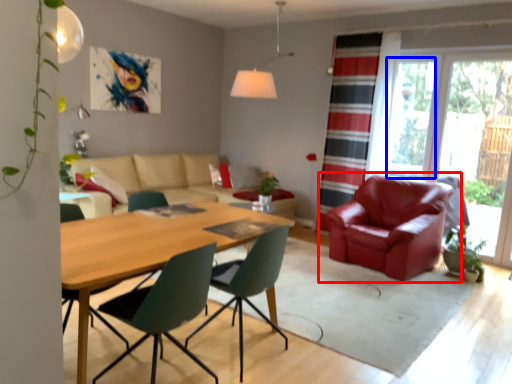
Question: Which object appears farthest to the camera in this image, chair (highlighted by a red box) or window screen (highlighted by a blue box)?

Choices:
 (A) chair
 (B) window screen

Answer: (B)